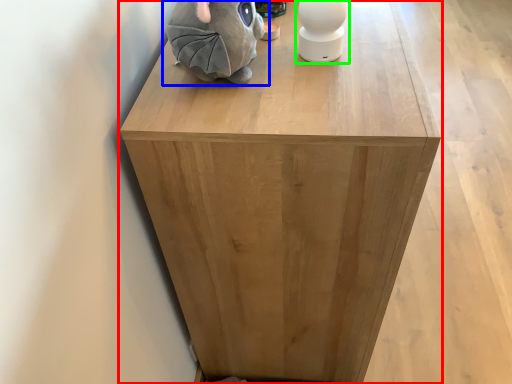
Question: Considering the real-world distances, which object is closest to furniture (highlighted by a red box)? toy (highlighted by a blue box) or toy (highlighted by a green box).

Choices:
 (A) toy
 (B) toy

Answer: (A)